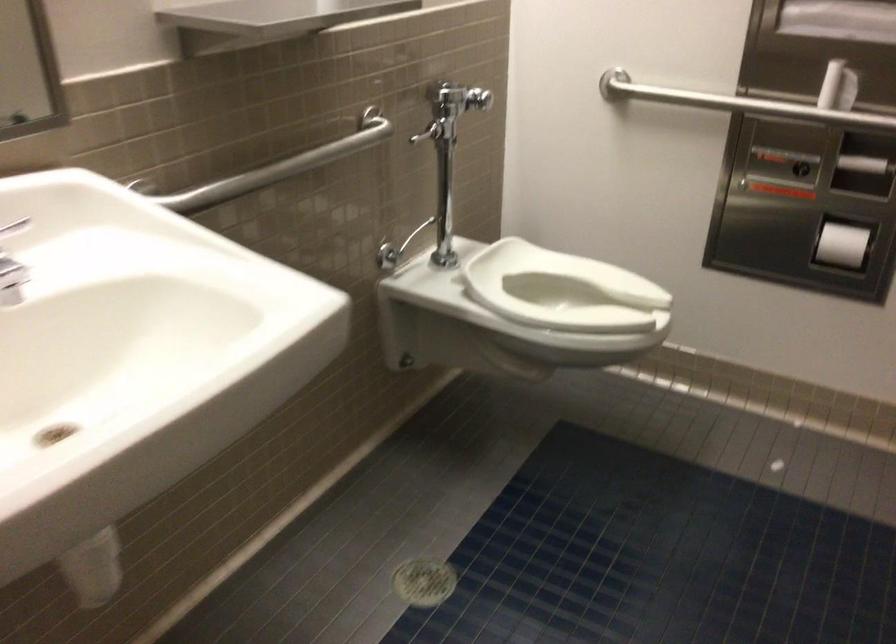
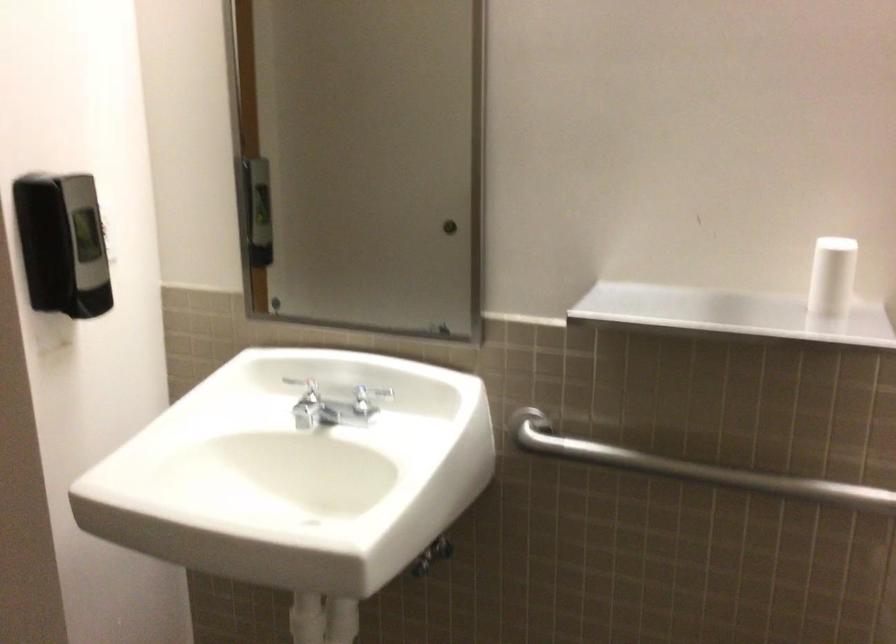
Where in the second image is the point corresponding to pixel 104 535 from the first image?

(325, 623)